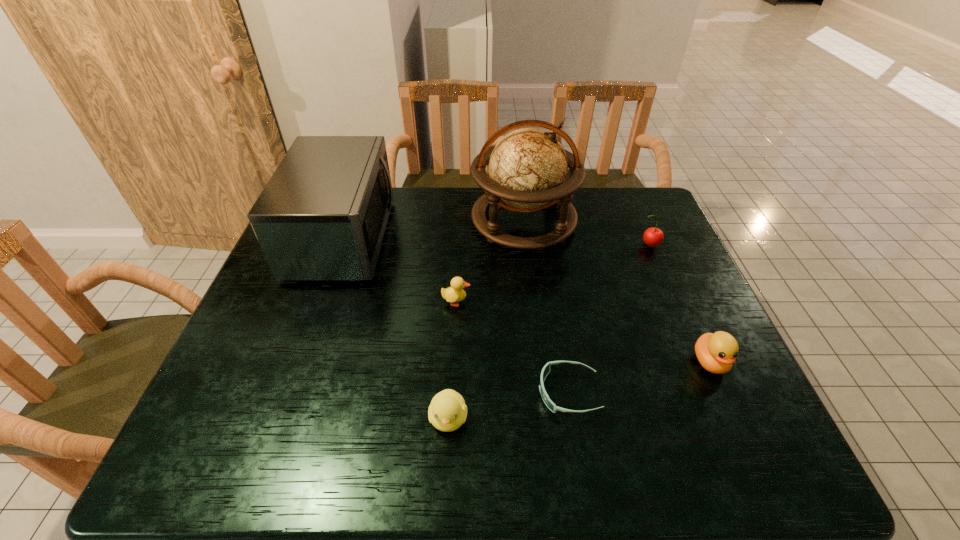
Locate an element on the screen. The width and height of the screenshot is (960, 540). cherry located at the right edge is located at coordinates (652, 236).

Image resolution: width=960 pixels, height=540 pixels. What are the coordinates of `duckling that is at the right edge` in the screenshot? It's located at (716, 352).

Identify the location of object that is positioned at the far left corner. This screenshot has width=960, height=540. (322, 216).

In the image, there is a desktop. At what (x,y) coordinates should I click in order to perform the action: click on vacant space at the far edge. Please return your answer as a coordinate pair (x, y). Image resolution: width=960 pixels, height=540 pixels. Looking at the image, I should click on (514, 224).

In the image, there is a desktop. Find the location of `vacant area at the near edge`. vacant area at the near edge is located at coordinates (324, 436).

Locate an element on the screen. The height and width of the screenshot is (540, 960). free region at the right edge of the desktop is located at coordinates (647, 293).

Where is `free space at the far right corner of the desktop`? The height and width of the screenshot is (540, 960). free space at the far right corner of the desktop is located at coordinates (630, 227).

In the image, there is a desktop. Identify the location of vacant space at the near right corner. This screenshot has height=540, width=960. (702, 444).

Where is `vacant point located between the shortest object and the globe`? vacant point located between the shortest object and the globe is located at coordinates (546, 307).

The width and height of the screenshot is (960, 540). What are the coordinates of `vacant space that is in between the nearest duckling and the cherry` in the screenshot? It's located at (548, 331).